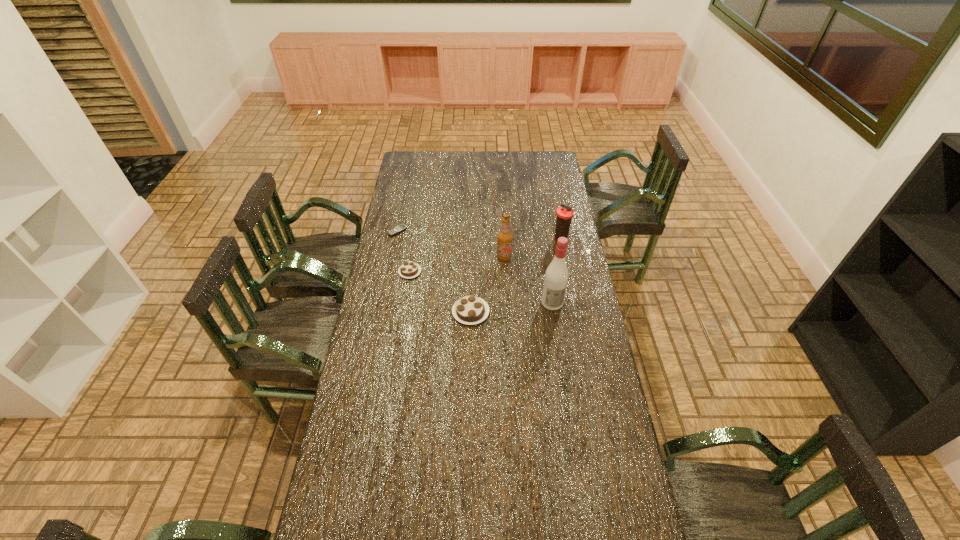
This screenshot has width=960, height=540. What are the coordinates of `alcohol that is at the right edge` in the screenshot? It's located at (556, 276).

In the image, there is a desktop. Where is `blank space at the far edge`? This screenshot has height=540, width=960. blank space at the far edge is located at coordinates (528, 167).

This screenshot has height=540, width=960. Find the location of `vacant region at the near edge of the desktop`. vacant region at the near edge of the desktop is located at coordinates (473, 514).

Find the location of `vacant space at the left edge`. vacant space at the left edge is located at coordinates (396, 214).

Identify the location of free region at the right edge. (545, 258).

The height and width of the screenshot is (540, 960). In the image, there is a desktop. What are the coordinates of `vacant space at the far left corner` in the screenshot? It's located at 409,165.

The image size is (960, 540). In the image, there is a desktop. Find the location of `free region at the far right corner`. free region at the far right corner is located at coordinates (530, 154).

Where is `free spot between the second object from right to left and the left chocolate cake`? free spot between the second object from right to left and the left chocolate cake is located at coordinates (481, 287).

Locate an element on the screen. This screenshot has width=960, height=540. free space between the fifth object from left to right and the shortest object is located at coordinates (475, 267).

This screenshot has width=960, height=540. Identify the location of vacant space that is in between the shortest object and the third object from right to left. (451, 245).